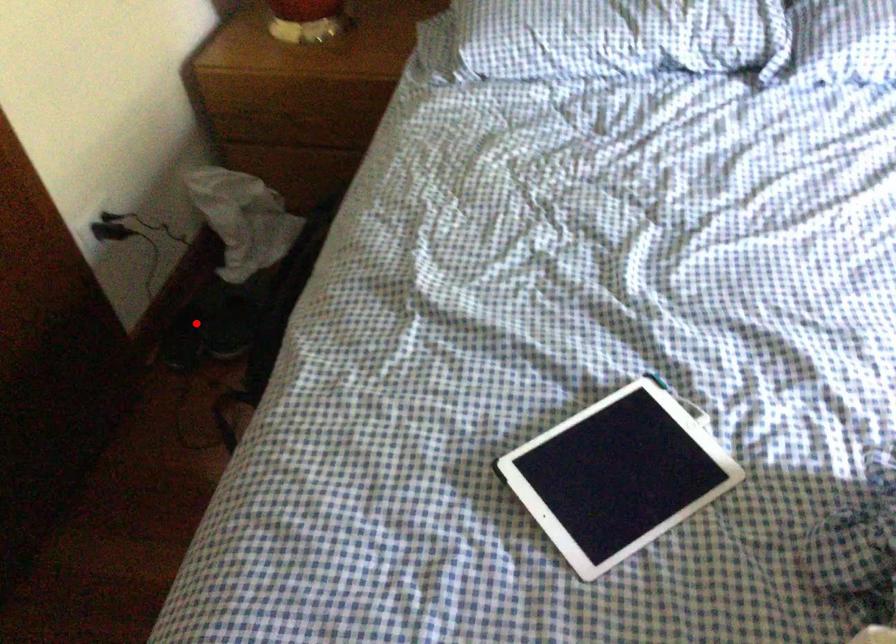
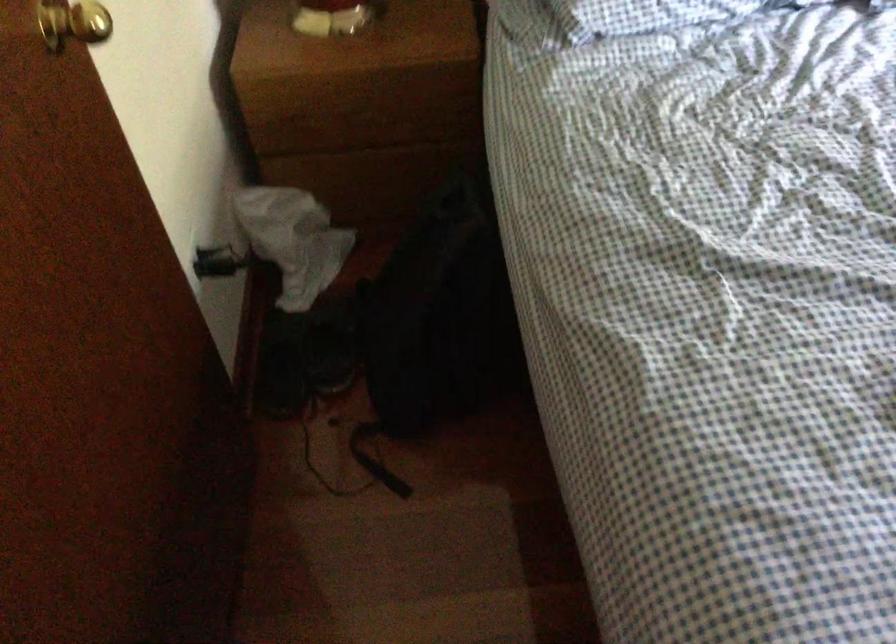
Question: I am providing you with two images of the same scene from different viewpoints. In image1, a red point is highlighted. Considering the same 3D point in image2, which of the following is correct?

Choices:
 (A) It is closer
 (B) It is farther

Answer: (A)